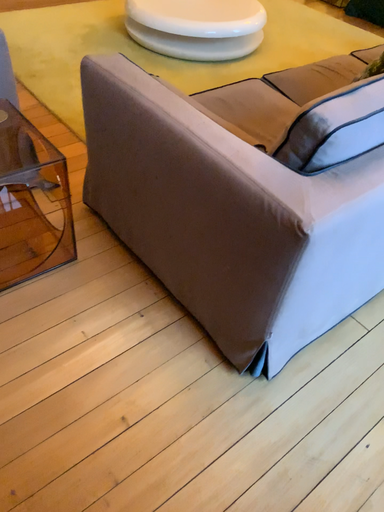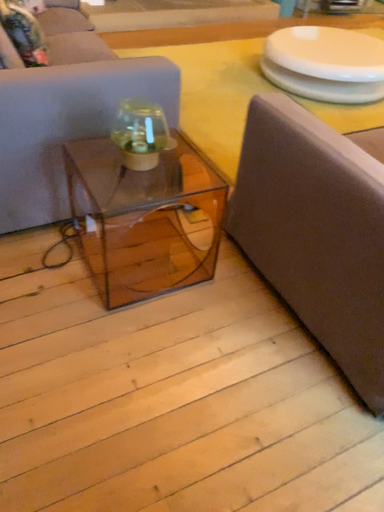
Question: Which way did the camera rotate in the video?

Choices:
 (A) rotated left
 (B) rotated right

Answer: (A)